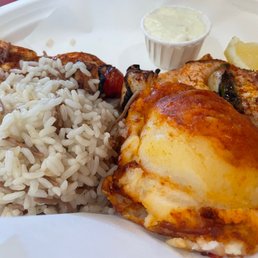
Where is `crumb`? crumb is located at coordinates (50, 42), (75, 42).